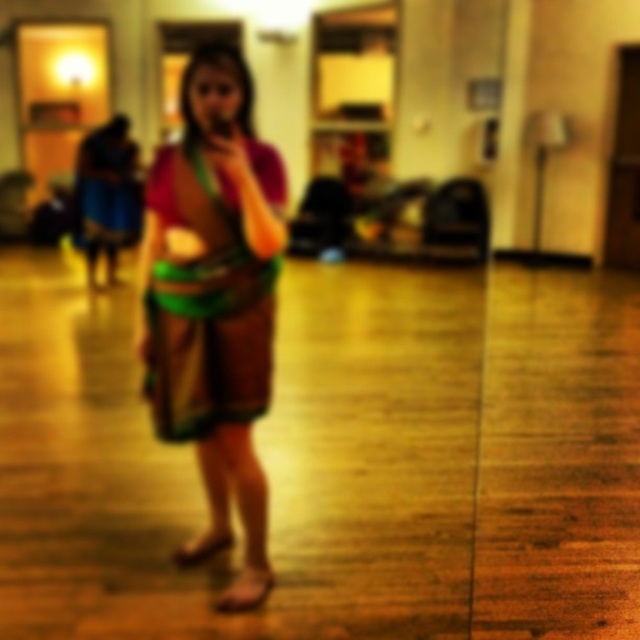
Does matte brown dress at center have a lesser width compared to multicolored fabric dress at center?

No, matte brown dress at center is not thinner than multicolored fabric dress at center.

Does matte brown dress at center have a larger size compared to multicolored fabric dress at center?

Yes.

Is point (244, 227) positioned behind point (205, 244)?

No, (244, 227) is closer to viewer.

Locate an element on the screen. The image size is (640, 640). matte brown dress at center is located at coordinates (214, 301).